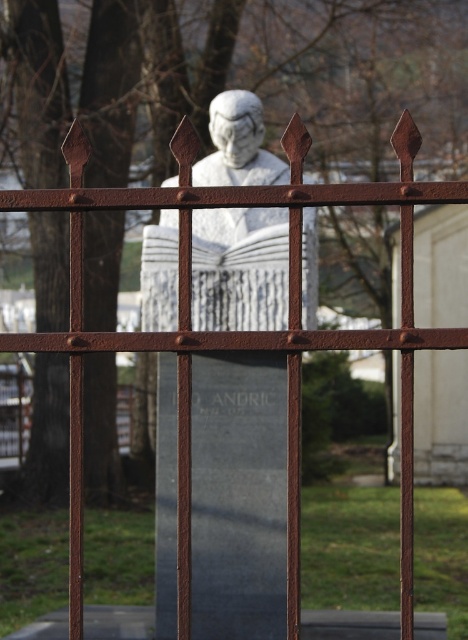
Does white marble bust at center appear over white marble statue at center?

No.

Does point (225, 150) lie in front of point (272, 170)?

No, it is not.

Does point (265, 328) come behind point (276, 301)?

That is False.

This screenshot has height=640, width=468. I want to click on white marble bust at center, so click(x=239, y=497).